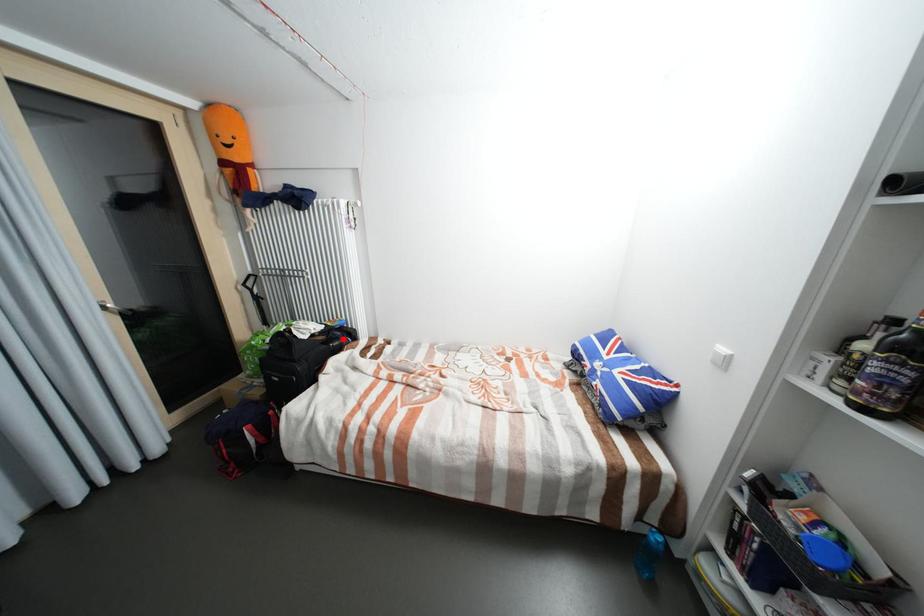
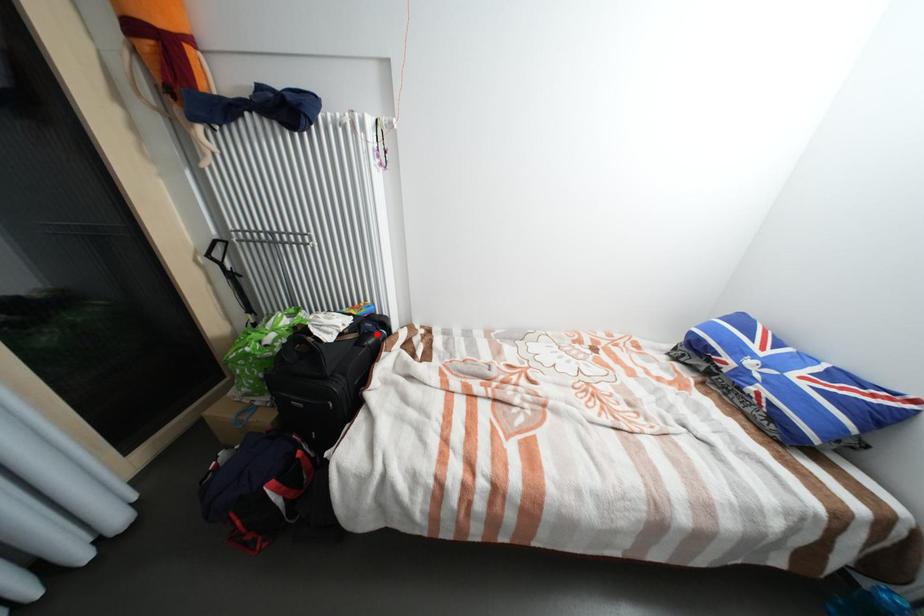
I am providing you with two images of the same scene from different viewpoints. A red point is marked on the first image and another point is marked on the second image. Does the point marked in image1 correspond to the same location as the one in image2?

Yes